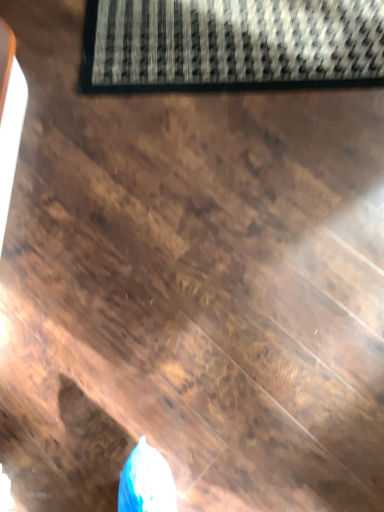
In order to face black textured mat at upper center, should I rotate leftwards or rightwards?

To align with it, rotate right about 6.153°.

What do you see at coordinates (230, 42) in the screenshot? I see `black textured mat at upper center` at bounding box center [230, 42].

You are a GUI agent. You are given a task and a screenshot of the screen. Output one action in this format:
    pyautogui.click(x=<x>, y=<y>)
    Task: Click on the black textured mat at upper center
    This screenshot has height=512, width=384.
    Given the screenshot: What is the action you would take?
    pyautogui.click(x=230, y=42)

Where is `black textured mat at upper center`? The height and width of the screenshot is (512, 384). black textured mat at upper center is located at coordinates (230, 42).